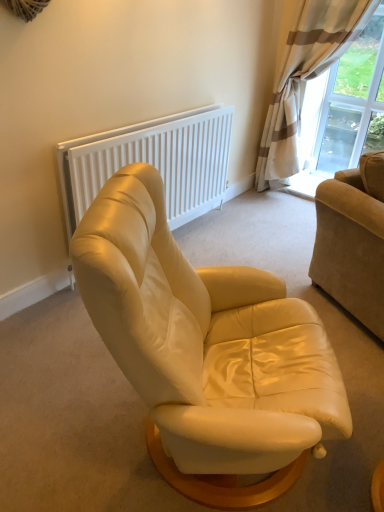
The image size is (384, 512). Find the location of `vacant region in front of beige striped curtain at upper right`. vacant region in front of beige striped curtain at upper right is located at coordinates (276, 232).